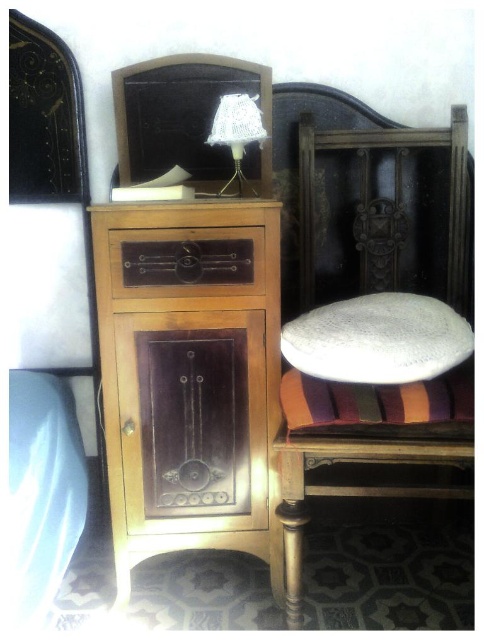
Does white fabric cushion at center have a larger size compared to velvet-like multicolored cushion at center?

Correct, white fabric cushion at center is larger in size than velvet-like multicolored cushion at center.

Which is more to the right, white fabric cushion at center or velvet-like multicolored cushion at center?

white fabric cushion at center

The height and width of the screenshot is (640, 484). I want to click on white fabric cushion at center, so click(382, 211).

Image resolution: width=484 pixels, height=640 pixels. What are the coordinates of `white fabric cushion at center` in the screenshot? It's located at (382, 211).

Does black leather headboard at upper center appear under white lace lampshade at upper center?

No.

Is point (126, 150) positioned before point (250, 97)?

That is False.

This screenshot has height=640, width=484. In order to click on black leather headboard at upper center in this screenshot , I will do `click(180, 115)`.

Can you confirm if white fabric cushion at center is positioned to the right of white lace lampshade at upper center?

Indeed, white fabric cushion at center is positioned on the right side of white lace lampshade at upper center.

Between white fabric cushion at center and white lace lampshade at upper center, which one has more height?

Standing taller between the two is white fabric cushion at center.

Who is more forward, (364,458) or (253,113)?

Point (364,458)

Identify the location of white fabric cushion at center. (382, 211).